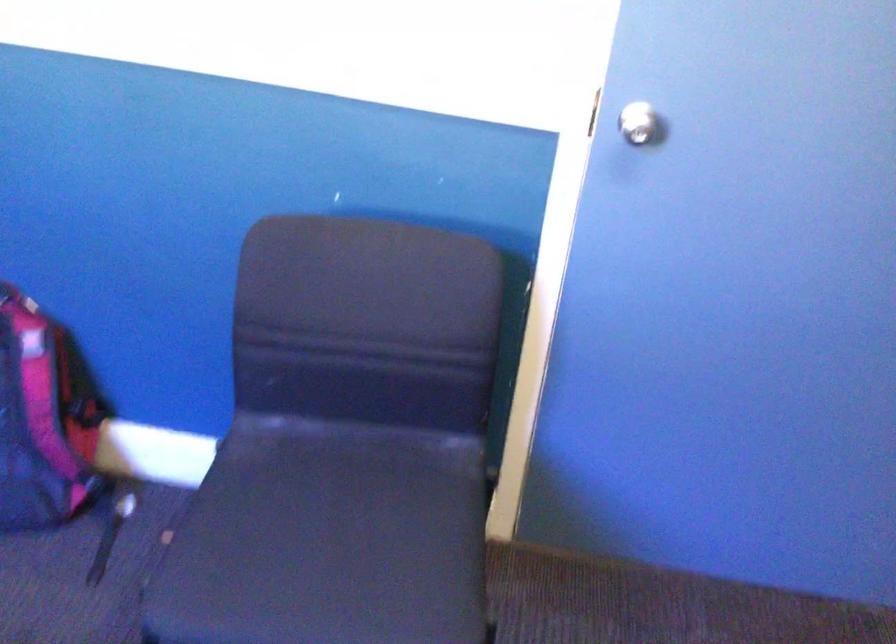
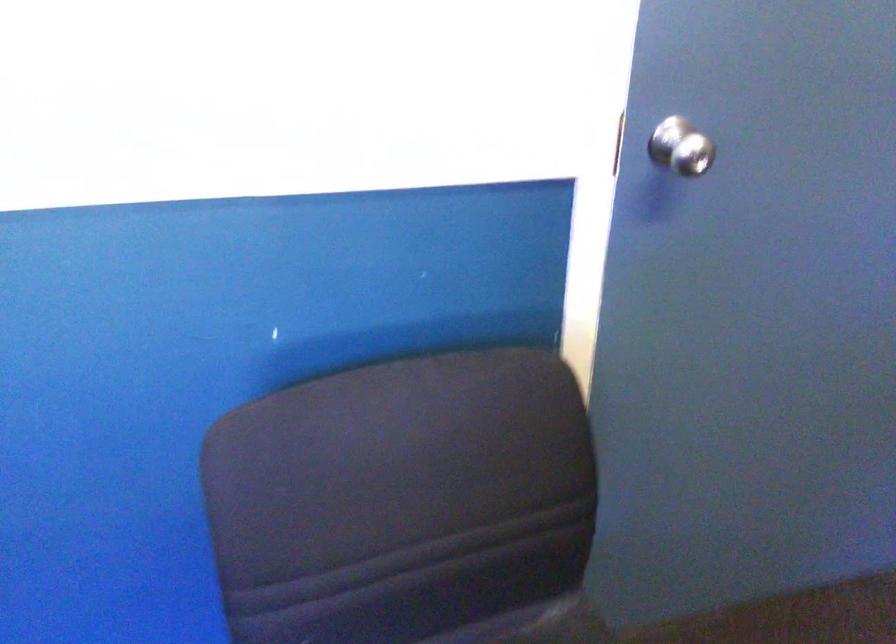
The point at (x=622, y=126) is marked in the first image. Where is the corresponding point in the second image?

(681, 147)